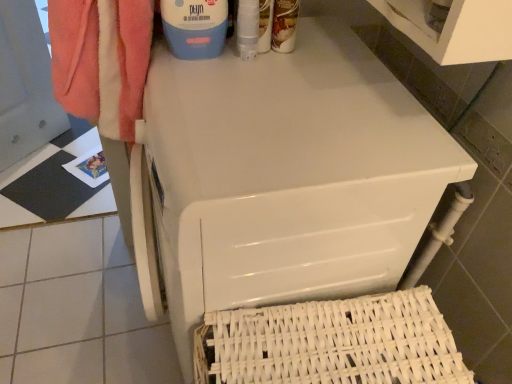
At what (x,y) coordinates should I click in order to perform the action: click on vacant area that is in front of matte brown bottle at upper center, the second cleaning product viewed from the left. Please return your answer as a coordinate pair (x, y). Looking at the image, I should click on (280, 79).